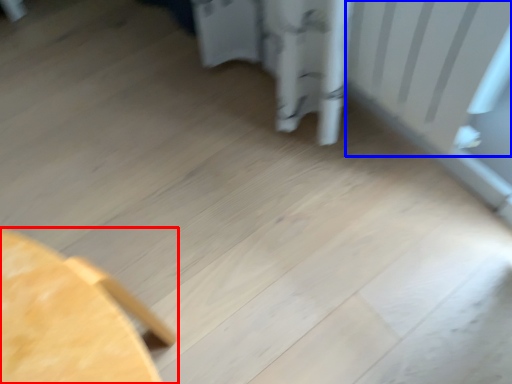
Question: Which point is further to the camera, furniture (highlighted by a red box) or radiator (highlighted by a blue box)?

Choices:
 (A) furniture
 (B) radiator

Answer: (B)